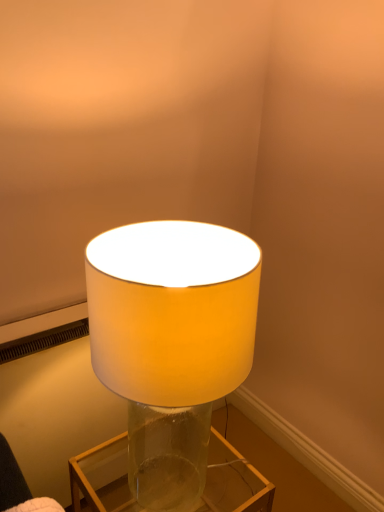
Image resolution: width=384 pixels, height=512 pixels. Describe the element at coordinates (172, 331) in the screenshot. I see `translucent glass lamp at center` at that location.

Locate an element on the screen. Image resolution: width=384 pixels, height=512 pixels. translucent glass lamp at center is located at coordinates (172, 331).

Locate an element on the screen. The height and width of the screenshot is (512, 384). translucent glass lamp at center is located at coordinates (172, 331).